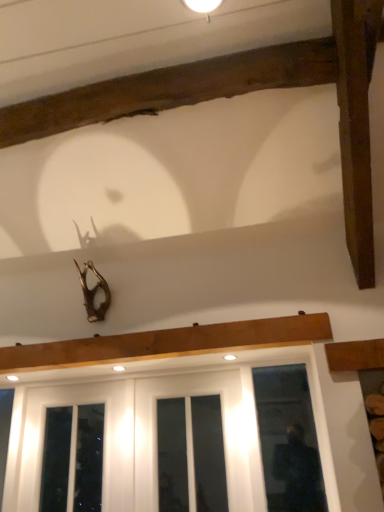
Question: Does white glossy screen door at lower center have a lesser width compared to white matte light fixture at upper center?

Choices:
 (A) no
 (B) yes

Answer: (B)

Question: From a real-world perspective, does white glossy screen door at lower center stand above white matte light fixture at upper center?

Choices:
 (A) yes
 (B) no

Answer: (B)

Question: Could you tell me if white glossy screen door at lower center is turned towards white matte light fixture at upper center?

Choices:
 (A) no
 (B) yes

Answer: (A)

Question: Can you confirm if white glossy screen door at lower center is bigger than white matte light fixture at upper center?

Choices:
 (A) no
 (B) yes

Answer: (B)

Question: Can you confirm if white glossy screen door at lower center is shorter than white matte light fixture at upper center?

Choices:
 (A) yes
 (B) no

Answer: (B)

Question: Could white matte light fixture at upper center be considered to be inside white glossy screen door at lower center?

Choices:
 (A) yes
 (B) no

Answer: (B)

Question: Considering the relative sizes of white glossy screen door at lower center and clear glass door at lower right, which appears as the 2th window when viewed from the left, in the image provided, is white glossy screen door at lower center bigger than clear glass door at lower right, which appears as the 2th window when viewed from the left,?

Choices:
 (A) yes
 (B) no

Answer: (A)

Question: Does white glossy screen door at lower center have a lesser width compared to clear glass door at lower right, positioned as the 1th window in right-to-left order?

Choices:
 (A) no
 (B) yes

Answer: (B)

Question: Is white glossy screen door at lower center oriented towards clear glass door at lower right, which appears as the 2th window when viewed from the left?

Choices:
 (A) no
 (B) yes

Answer: (A)

Question: Considering the relative sizes of white glossy screen door at lower center and clear glass door at lower right, positioned as the 1th window in right-to-left order, in the image provided, is white glossy screen door at lower center smaller than clear glass door at lower right, positioned as the 1th window in right-to-left order,?

Choices:
 (A) no
 (B) yes

Answer: (A)

Question: Can you confirm if white glossy screen door at lower center is taller than clear glass door at lower right, positioned as the 1th window in right-to-left order?

Choices:
 (A) no
 (B) yes

Answer: (A)

Question: Are white glossy screen door at lower center and clear glass door at lower right, positioned as the 1th window in right-to-left order, making contact?

Choices:
 (A) yes
 (B) no

Answer: (B)

Question: Is white glossy wood at lower center, which is counted as the 1th window, starting from the left, bigger than white matte light fixture at upper center?

Choices:
 (A) no
 (B) yes

Answer: (B)